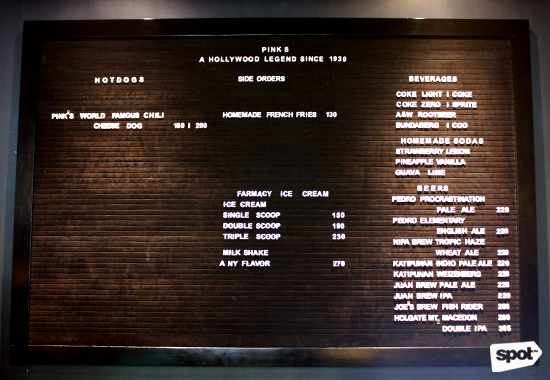
Where is `dark wall behind sign`? The width and height of the screenshot is (550, 380). dark wall behind sign is located at coordinates (543, 92).